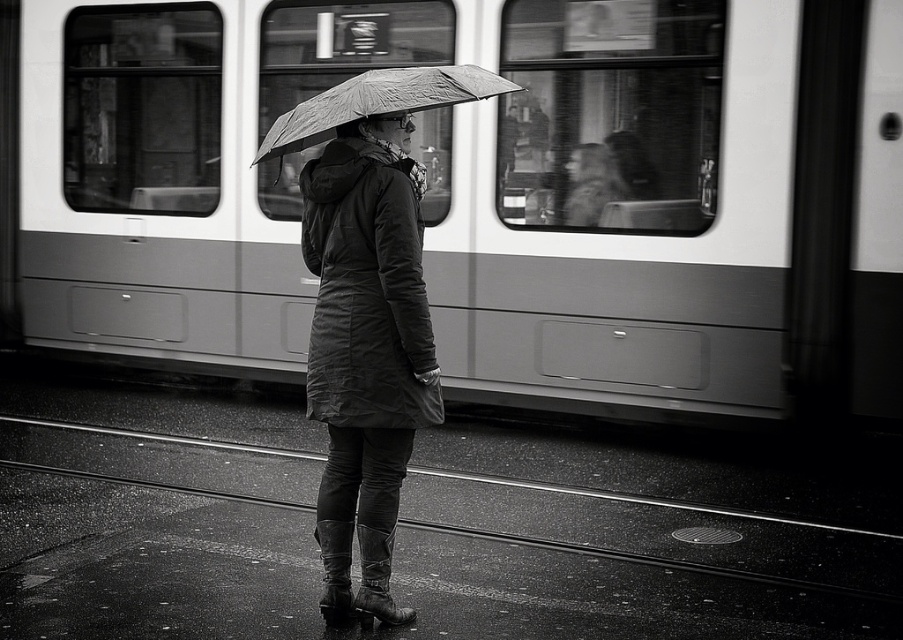
Question: Which of the following is the closest to the observer?

Choices:
 (A) (208, 280)
 (B) (340, 88)

Answer: (B)

Question: Does matte black coat at center appear under textured fabric umbrella at center?

Choices:
 (A) yes
 (B) no

Answer: (A)

Question: Does smooth metal train at center appear over matte black coat at center?

Choices:
 (A) no
 (B) yes

Answer: (B)

Question: Among these objects, which one is farthest from the camera?

Choices:
 (A) matte black coat at center
 (B) textured fabric umbrella at center

Answer: (A)

Question: Is the position of matte black coat at center less distant than that of textured fabric umbrella at center?

Choices:
 (A) no
 (B) yes

Answer: (A)

Question: Which point is farther from the camera taking this photo?

Choices:
 (A) [x=374, y=72]
 (B) [x=340, y=563]
 (C) [x=480, y=186]

Answer: (C)